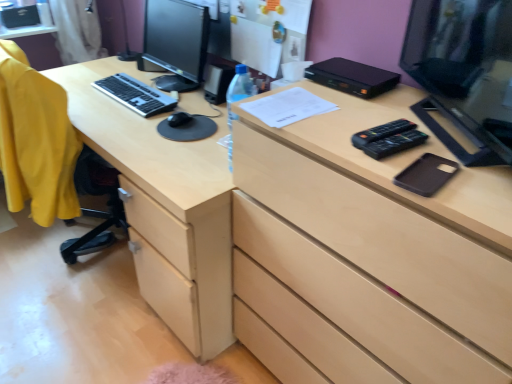
I want to click on vacant area that lies in front of black matte mouse at center, so pyautogui.click(x=164, y=133).